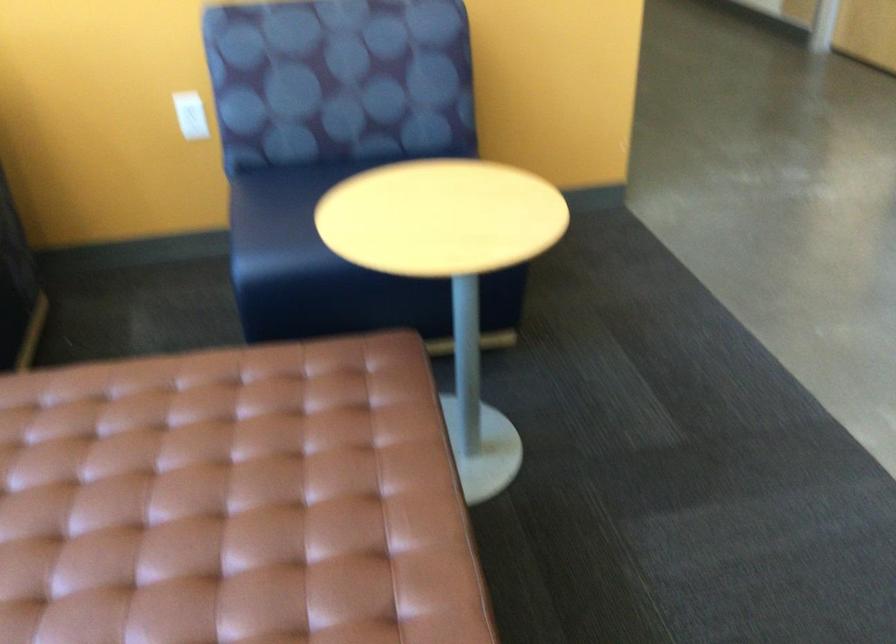
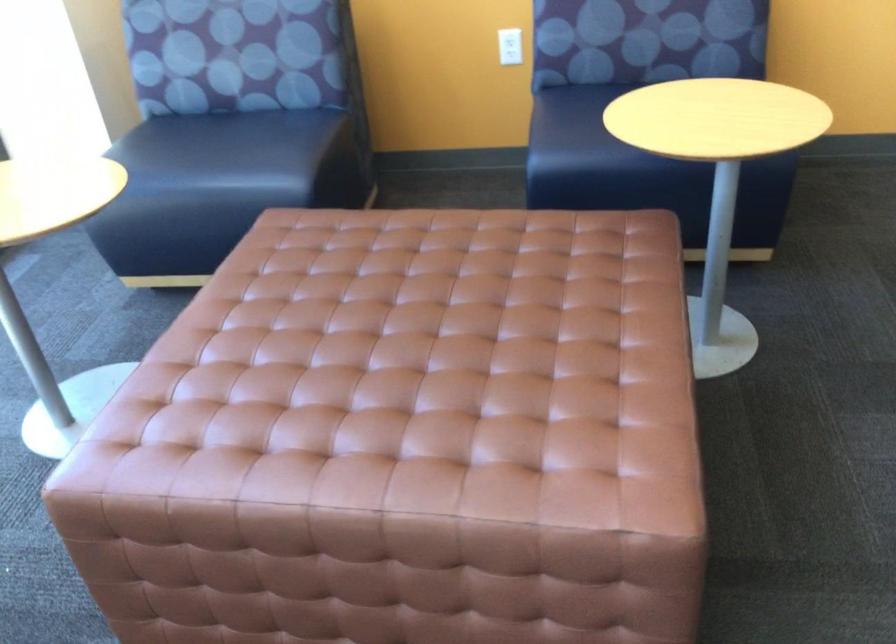
Where in the second image is the point corresponding to the point at 311,240 from the first image?

(593, 146)